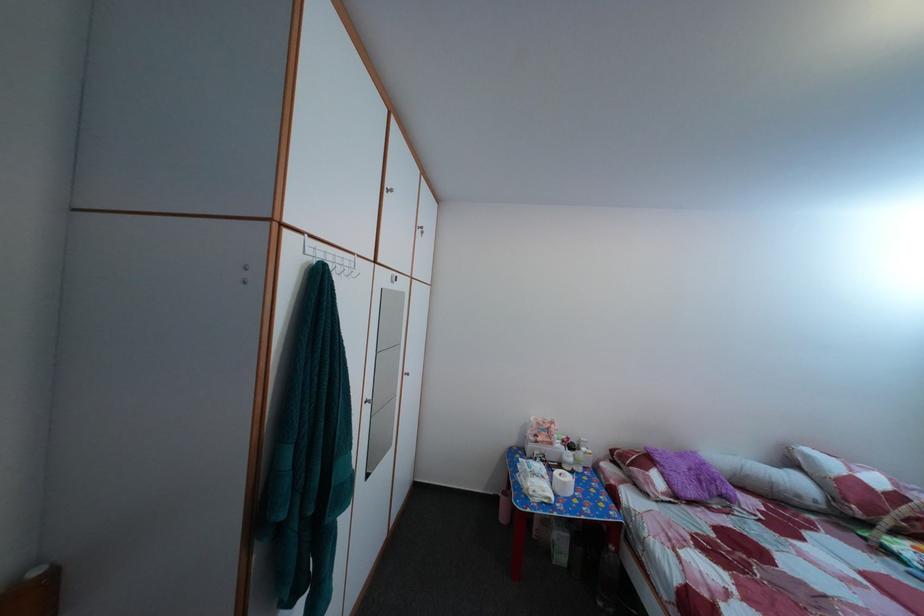
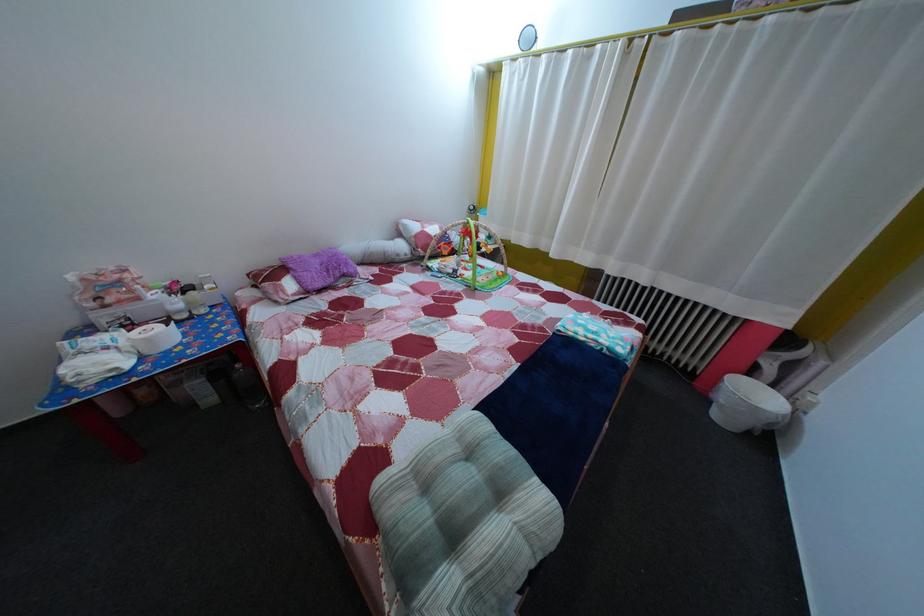
Based on the continuous images, in which direction is the camera rotating?

The camera rotated toward right-down.